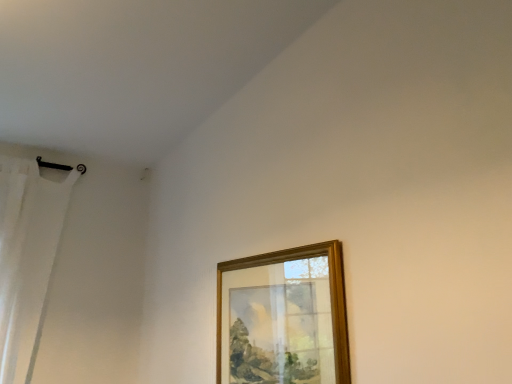
Question: Considering the relative sizes of wooden picture frame at upper center and white sheer curtain at left in the image provided, is wooden picture frame at upper center taller than white sheer curtain at left?

Choices:
 (A) yes
 (B) no

Answer: (B)

Question: Is wooden picture frame at upper center aimed at white sheer curtain at left?

Choices:
 (A) yes
 (B) no

Answer: (B)

Question: Does wooden picture frame at upper center appear on the left side of white sheer curtain at left?

Choices:
 (A) no
 (B) yes

Answer: (A)

Question: Can you confirm if wooden picture frame at upper center is wider than white sheer curtain at left?

Choices:
 (A) no
 (B) yes

Answer: (A)

Question: From the image's perspective, would you say wooden picture frame at upper center is positioned over white sheer curtain at left?

Choices:
 (A) no
 (B) yes

Answer: (A)

Question: Can you confirm if wooden picture frame at upper center is shorter than white sheer curtain at left?

Choices:
 (A) no
 (B) yes

Answer: (B)

Question: Is wooden picture frame at upper center surrounded by white sheer curtain at left?

Choices:
 (A) yes
 (B) no

Answer: (B)

Question: Is white sheer curtain at left shorter than wooden picture frame at upper center?

Choices:
 (A) yes
 (B) no

Answer: (B)

Question: Could you tell me if white sheer curtain at left is facing wooden picture frame at upper center?

Choices:
 (A) yes
 (B) no

Answer: (B)

Question: Does white sheer curtain at left lie in front of wooden picture frame at upper center?

Choices:
 (A) yes
 (B) no

Answer: (B)

Question: From a real-world perspective, is white sheer curtain at left physically below wooden picture frame at upper center?

Choices:
 (A) yes
 (B) no

Answer: (B)

Question: Is white sheer curtain at left wider than wooden picture frame at upper center?

Choices:
 (A) yes
 (B) no

Answer: (A)

Question: In terms of height, does wooden picture frame at upper center look taller or shorter compared to white sheer curtain at left?

Choices:
 (A) tall
 (B) short

Answer: (B)